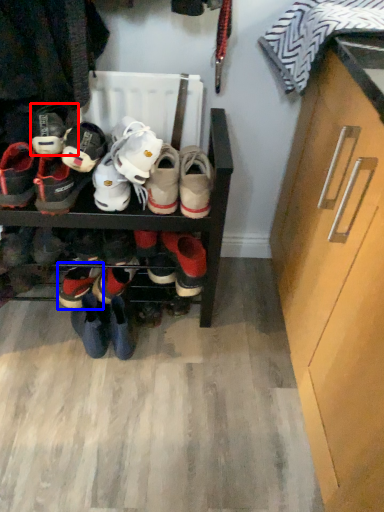
Question: Which object is further to the camera taking this photo, footwear (highlighted by a red box) or footwear (highlighted by a blue box)?

Choices:
 (A) footwear
 (B) footwear

Answer: (B)